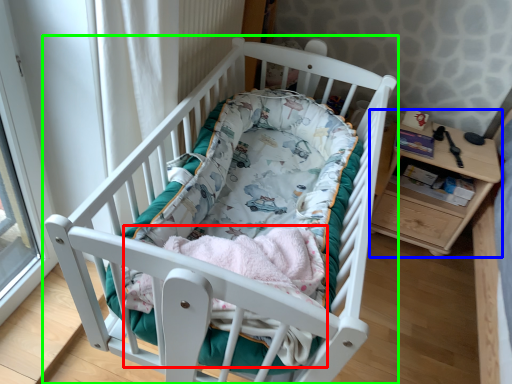
Question: Which is farther away from baby clothe (highlighted by a red box)? changing table (highlighted by a blue box) or infant bed (highlighted by a green box)?

Choices:
 (A) changing table
 (B) infant bed

Answer: (A)